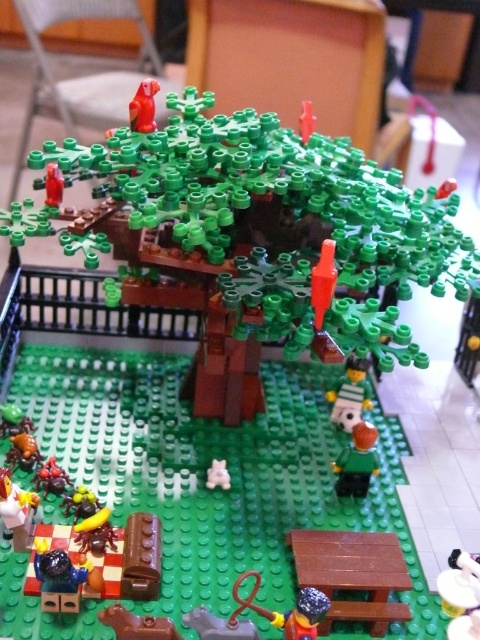
Does brown matte/rough brick at lower center have a smaller size compared to smooth white soccer ball at center?

Yes, brown matte/rough brick at lower center is smaller than smooth white soccer ball at center.

Describe the element at coordinates (136, 625) in the screenshot. I see `brown matte/rough brick at lower center` at that location.

Which is behind, point (121, 618) or point (336, 390)?

Point (336, 390)

Find the location of a particular element. The height and width of the screenshot is (640, 480). brown matte/rough brick at lower center is located at coordinates (136, 625).

Between green matte tree at center and shiny red hammer at center, which one has more height?

green matte tree at center

Describe the element at coordinates (253, 237) in the screenshot. This screenshot has height=640, width=480. I see `green matte tree at center` at that location.

Which is in front, point (137, 244) or point (300, 588)?

Point (300, 588)

At what (x,y) coordinates should I click in order to perform the action: click on green matte tree at center. Please return your answer as a coordinate pair (x, y). This screenshot has width=480, height=640. Looking at the image, I should click on (253, 237).

Which of these two, green matte tree at center or green matte figure at lower center, stands shorter?

green matte figure at lower center

Does point (218, 268) lie in front of point (352, 492)?

Yes.

Where is `green matte tree at center`? green matte tree at center is located at coordinates (253, 237).